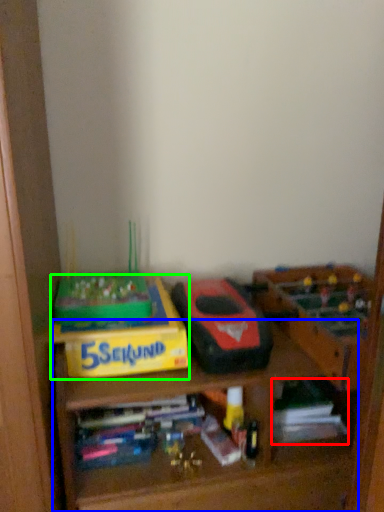
Question: Which object is the farthest from book (highlighted by a red box)? Choose among these: shelf (highlighted by a blue box) or cardboard box (highlighted by a green box).

Choices:
 (A) shelf
 (B) cardboard box

Answer: (B)